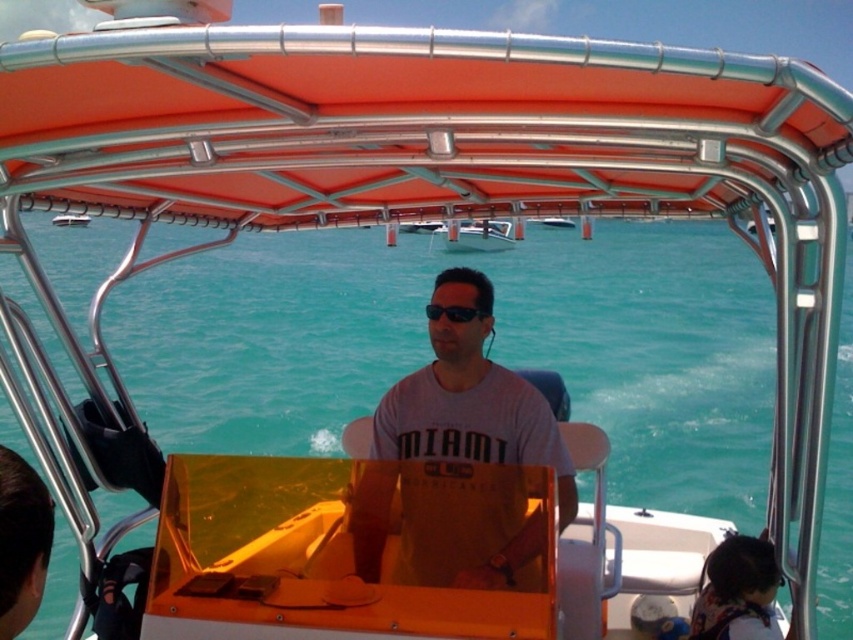
You are designing a safety manual for boaters and need to know the relative sizes of the metallic silver boat at center and the black matte sunglasses at center. Which object is taller?

The metallic silver boat at center is taller than the black matte sunglasses at center according to the description.

You are on a boat and need to adjust your sunglasses. Based on the scene, where should you look relative to the metallic silver boat at center to find your black matte sunglasses at center?

The black matte sunglasses at center are below the metallic silver boat at center since the boat is positioned above them.

You are on a boat and need to navigate between two points marked as point (479, 243) and point (461, 310). Based on their positions, which point is located behind the other?

Point (479, 243) is behind point (461, 310).